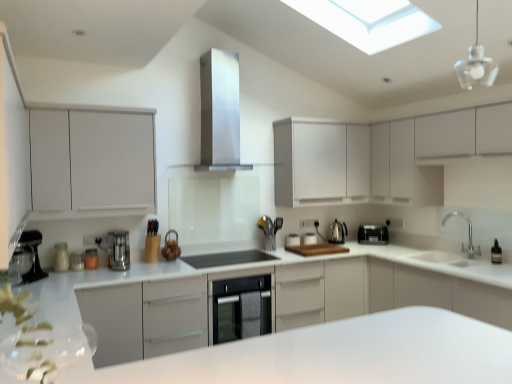
Question: Is metallic silver coffee maker at left, which ranks as the 1th appliance in left-to-right order, aimed at metallic silver toaster at lower left, arranged as the third appliance when viewed from the left?

Choices:
 (A) yes
 (B) no

Answer: (B)

Question: From a real-world perspective, is metallic silver coffee maker at left, which ranks as the 1th appliance in left-to-right order, under metallic silver toaster at lower left, arranged as the third appliance when viewed from the left?

Choices:
 (A) no
 (B) yes

Answer: (A)

Question: Is metallic silver coffee maker at left, which ranks as the 1th appliance in left-to-right order, to the right of metallic silver toaster at lower left, which appears as the 6th appliance when viewed from the right, from the viewer's perspective?

Choices:
 (A) no
 (B) yes

Answer: (A)

Question: Can you confirm if metallic silver coffee maker at left, the 8th appliance when ordered from right to left, is bigger than metallic silver toaster at lower left, which appears as the 6th appliance when viewed from the right?

Choices:
 (A) no
 (B) yes

Answer: (B)

Question: Can you confirm if metallic silver coffee maker at left, which ranks as the 1th appliance in left-to-right order, is positioned to the left of metallic silver toaster at lower left, arranged as the third appliance when viewed from the left?

Choices:
 (A) yes
 (B) no

Answer: (A)

Question: Considering the positions of white matte cabinet at upper right, the 1th cabinetry viewed from the right, and white matte cabinet at upper center, the third cabinetry positioned from the left, in the image, is white matte cabinet at upper right, the 1th cabinetry viewed from the right, taller or shorter than white matte cabinet at upper center, the third cabinetry positioned from the left,?

Choices:
 (A) tall
 (B) short

Answer: (A)

Question: Is point (312, 180) positioned closer to the camera than point (353, 135)?

Choices:
 (A) farther
 (B) closer

Answer: (B)

Question: Is white matte cabinet at upper right, the 1th cabinetry viewed from the right, in front of or behind white matte cabinet at upper center, the second cabinetry positioned from the right, in the image?

Choices:
 (A) behind
 (B) front

Answer: (B)

Question: From a real-world perspective, is white matte cabinet at upper right, the 4th cabinetry positioned from the left, physically located above or below white matte cabinet at upper center, the third cabinetry positioned from the left?

Choices:
 (A) above
 (B) below

Answer: (A)

Question: From a real-world perspective, is metallic silver coffee maker at left, which ranks as the 1th appliance in left-to-right order, positioned above or below satin steel dishwasher at center?

Choices:
 (A) below
 (B) above

Answer: (B)

Question: From the image's perspective, is metallic silver coffee maker at left, which ranks as the 1th appliance in left-to-right order, above or below satin steel dishwasher at center?

Choices:
 (A) above
 (B) below

Answer: (A)

Question: Is point (64, 244) positioned closer to the camera than point (219, 331)?

Choices:
 (A) closer
 (B) farther

Answer: (A)

Question: In terms of size, does metallic silver coffee maker at left, the 8th appliance when ordered from right to left, appear bigger or smaller than satin steel dishwasher at center?

Choices:
 (A) big
 (B) small

Answer: (B)

Question: Is white glossy countertop at center bigger or smaller than white glossy toaster at center, the 1th appliance viewed from the right?

Choices:
 (A) big
 (B) small

Answer: (A)

Question: Would you say white glossy countertop at center is inside or outside white glossy toaster at center, the eighth appliance from the left?

Choices:
 (A) inside
 (B) outside

Answer: (B)